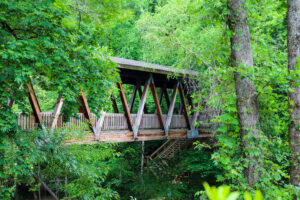
This screenshot has width=300, height=200. I want to click on staircase, so click(165, 149).